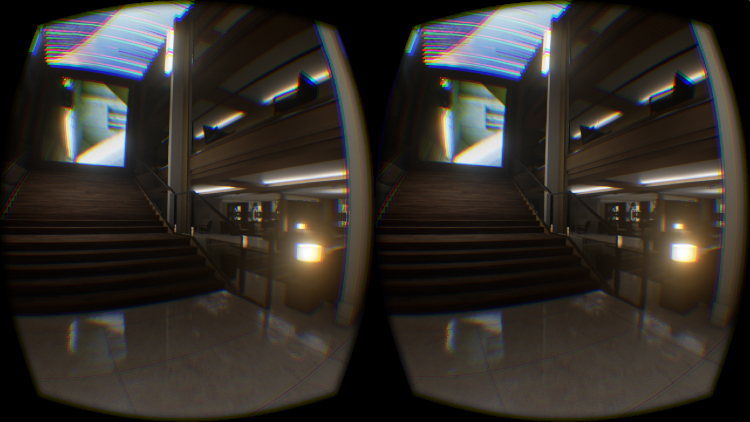
Locate an element on the screen. The image size is (750, 422). tile is located at coordinates 542,378.